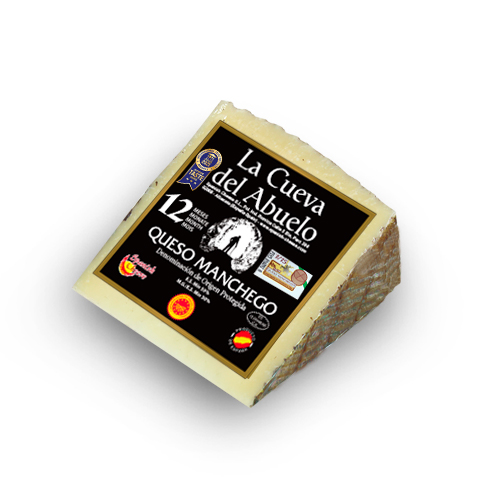
Find the location of a particular element. The width and height of the screenshot is (500, 500). gold border is located at coordinates (356, 236).